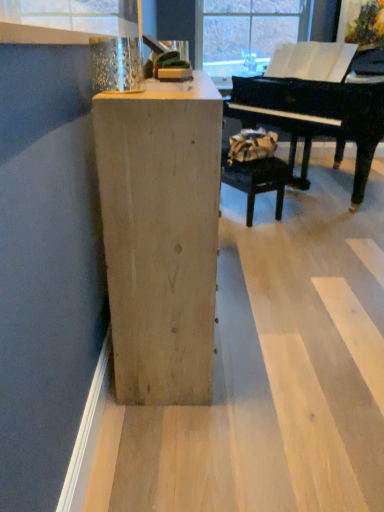
Question: Is the depth of metallic glass at upper left less than that of natural wood cabinet at center?

Choices:
 (A) no
 (B) yes

Answer: (B)

Question: Can you confirm if metallic glass at upper left is bigger than natural wood cabinet at center?

Choices:
 (A) yes
 (B) no

Answer: (B)

Question: Could you tell me if metallic glass at upper left is turned towards natural wood cabinet at center?

Choices:
 (A) yes
 (B) no

Answer: (B)

Question: Are metallic glass at upper left and natural wood cabinet at center far apart?

Choices:
 (A) no
 (B) yes

Answer: (A)

Question: Considering the relative sizes of metallic glass at upper left and natural wood cabinet at center in the image provided, is metallic glass at upper left wider than natural wood cabinet at center?

Choices:
 (A) no
 (B) yes

Answer: (A)

Question: Is point (254, 118) closer or farther from the camera than point (147, 374)?

Choices:
 (A) farther
 (B) closer

Answer: (A)

Question: Relative to natural wood cabinet at center, is black polished piano at upper right in front or behind?

Choices:
 (A) front
 (B) behind

Answer: (B)

Question: From a real-world perspective, is black polished piano at upper right physically located above or below natural wood cabinet at center?

Choices:
 (A) below
 (B) above

Answer: (B)

Question: From the image's perspective, relative to natural wood cabinet at center, is black polished piano at upper right above or below?

Choices:
 (A) above
 (B) below

Answer: (A)

Question: From the image's perspective, relative to black polished piano at upper right, is leather-like brown bag at center above or below?

Choices:
 (A) below
 (B) above

Answer: (A)

Question: Is point (279, 211) closer or farther from the camera than point (332, 133)?

Choices:
 (A) closer
 (B) farther

Answer: (B)

Question: In terms of height, does leather-like brown bag at center look taller or shorter compared to black polished piano at upper right?

Choices:
 (A) short
 (B) tall

Answer: (A)

Question: Considering the positions of leather-like brown bag at center and black polished piano at upper right in the image, is leather-like brown bag at center bigger or smaller than black polished piano at upper right?

Choices:
 (A) small
 (B) big

Answer: (A)

Question: Is natural wood cabinet at center inside the boundaries of black polished piano at upper right, or outside?

Choices:
 (A) outside
 (B) inside

Answer: (A)

Question: From the image's perspective, relative to black polished piano at upper right, is natural wood cabinet at center above or below?

Choices:
 (A) below
 (B) above

Answer: (A)